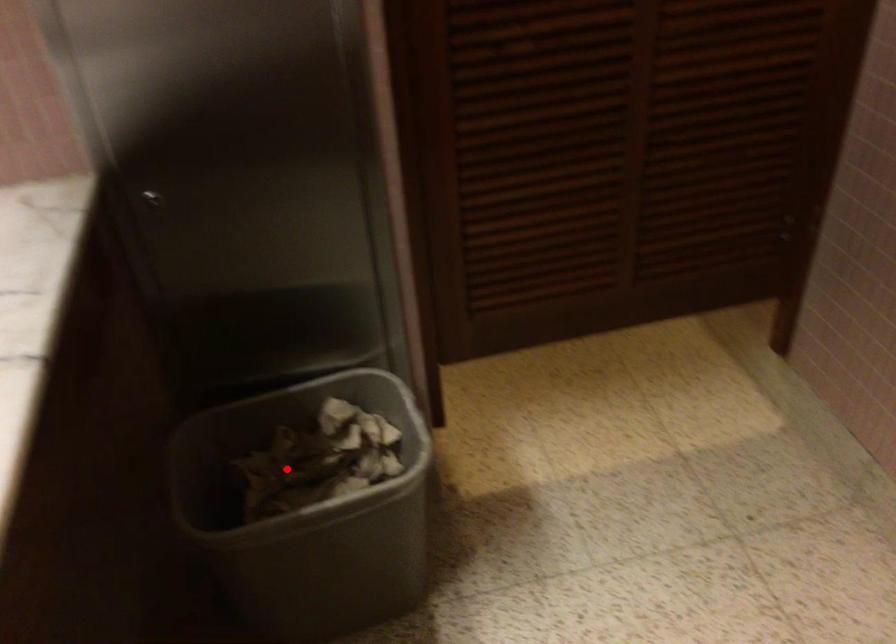
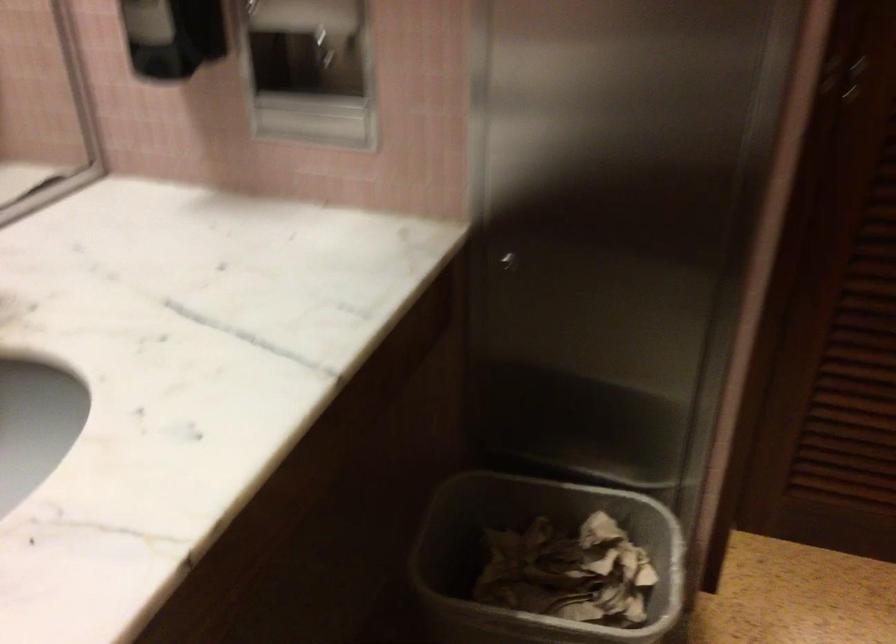
In the second image, find the point that corresponds to the highlighted location in the first image.

(533, 558)